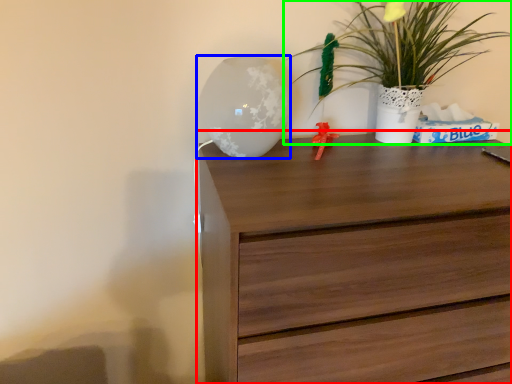
Question: Estimate the real-world distances between objects in this image. Which object is farther from chest of drawers (highlighted by a red box), table lamp (highlighted by a blue box) or houseplant (highlighted by a green box)?

Choices:
 (A) table lamp
 (B) houseplant

Answer: (B)